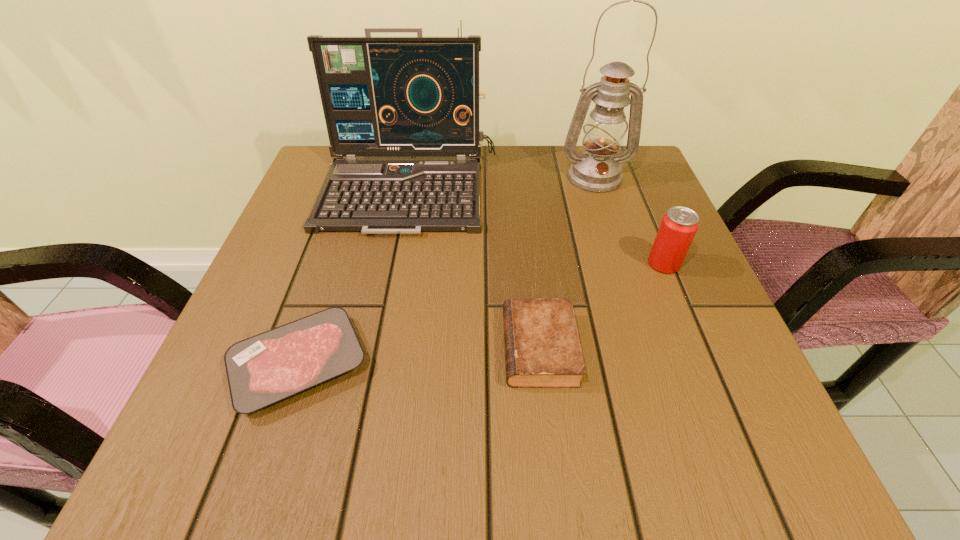
Identify the location of object that can be found as the fourth closest to the fourth shortest object. (679, 225).

You are a GUI agent. You are given a task and a screenshot of the screen. Output one action in this format:
    pyautogui.click(x=<x>, y=<y>)
    Task: Click on the free space that satisfies the following two spatial constraints: 1. on the spine side of the diary; 2. on the front side of the shortest object
    Image resolution: width=960 pixels, height=540 pixels.
    Given the screenshot: What is the action you would take?
    pyautogui.click(x=541, y=364)

Locate an element on the screen. The width and height of the screenshot is (960, 540). vacant space that satisfies the following two spatial constraints: 1. on the front-facing side of the can; 2. on the left side of the laptop computer is located at coordinates (396, 264).

What are the coordinates of `vacant space that satisfies the following two spatial constraints: 1. on the front side of the tallest object; 2. on the spine side of the third object from right to left` in the screenshot? It's located at (650, 348).